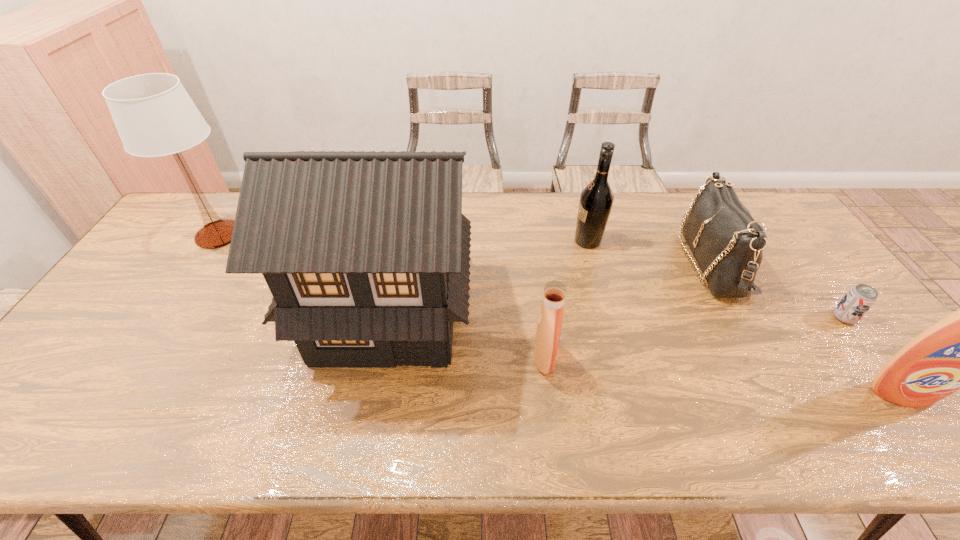
The width and height of the screenshot is (960, 540). What are the coordinates of `vacant point that satisfies the following two spatial constraints: 1. on the front side of the beer can; 2. on the front-facing side of the third object from left to right` in the screenshot? It's located at (875, 358).

The image size is (960, 540). I want to click on free space that satisfies the following two spatial constraints: 1. on the back side of the beer can; 2. at the front of the handbag with chain and zipper, so click(803, 262).

Locate an element on the screen. vacant space that satisfies the following two spatial constraints: 1. at the front of the handbag with chain and zipper; 2. on the back side of the shortest object is located at coordinates (740, 318).

The width and height of the screenshot is (960, 540). Identify the location of free spot that satisfies the following two spatial constraints: 1. on the label of the fourth object from right to left; 2. on the front-facing side of the dollhouse. (607, 312).

The height and width of the screenshot is (540, 960). Find the location of `free space that satisfies the following two spatial constraints: 1. on the back side of the beer can; 2. at the front of the handbag with chain and zipper`. free space that satisfies the following two spatial constraints: 1. on the back side of the beer can; 2. at the front of the handbag with chain and zipper is located at coordinates (803, 262).